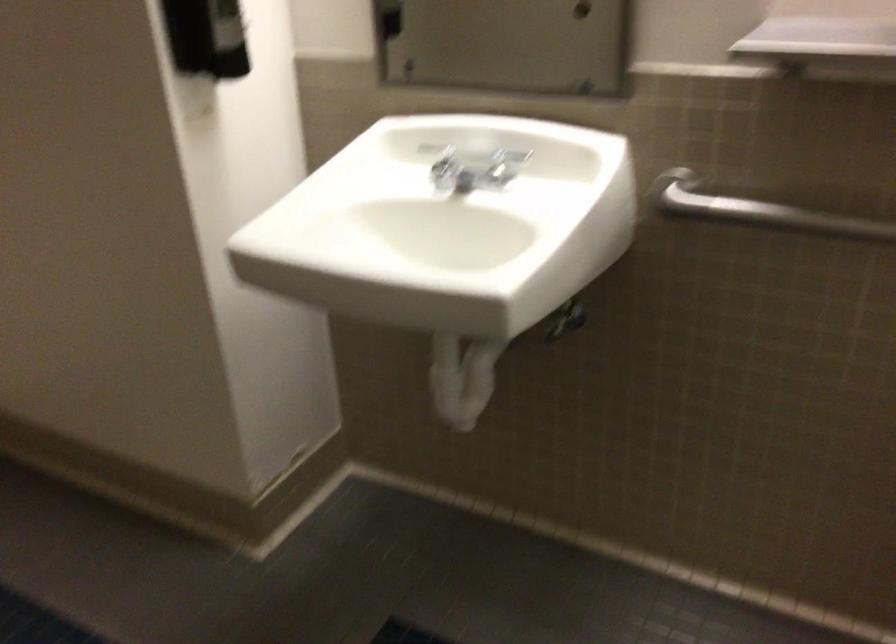
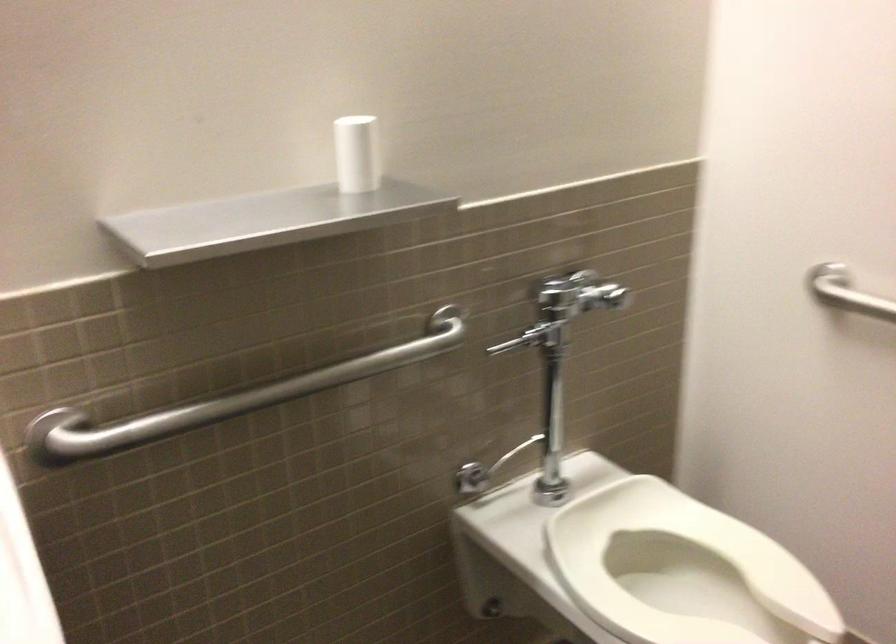
Question: The images are taken continuously from a first-person perspective. In which direction is your viewpoint rotating?

Choices:
 (A) Left
 (B) Right
 (C) Up
 (D) Down

Answer: (B)